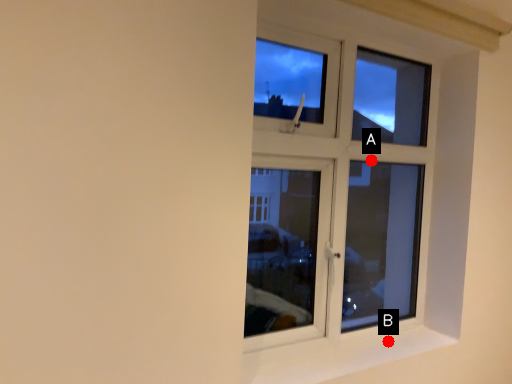
Question: Two points are circled on the image, labeled by A and B beside each circle. Among these points, which one is farthest from the camera?

Choices:
 (A) A is further
 (B) B is further

Answer: (A)